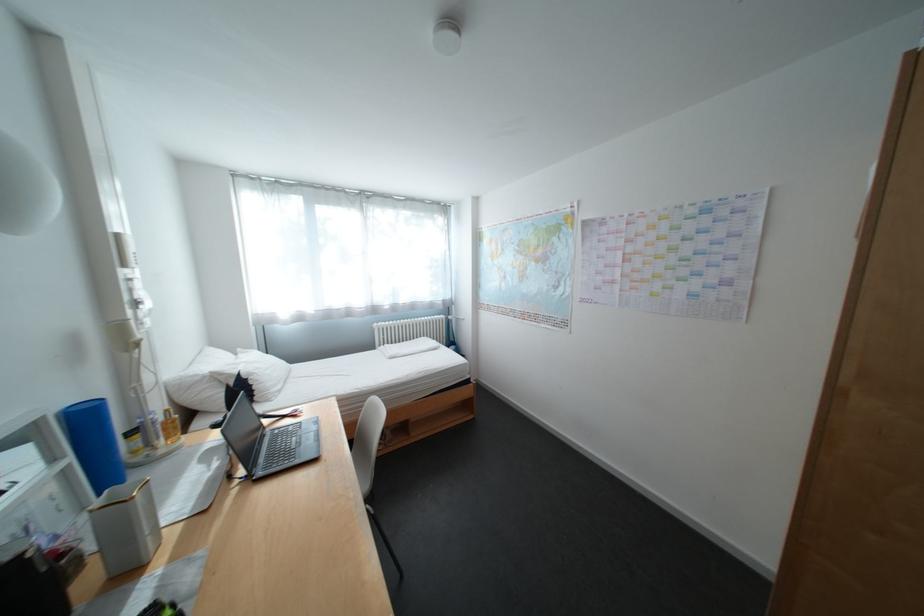
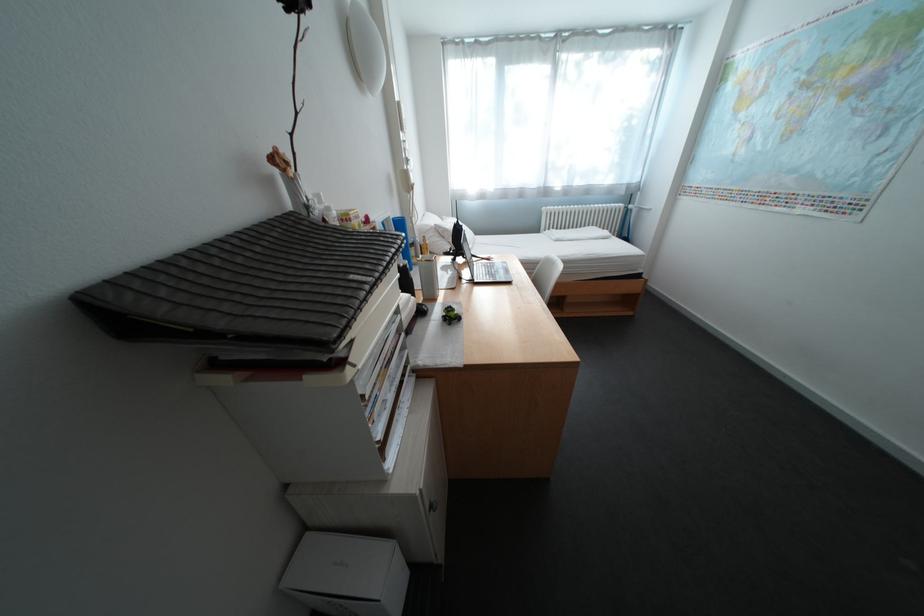
How did the camera likely rotate?

The camera's rotation is toward left-down.